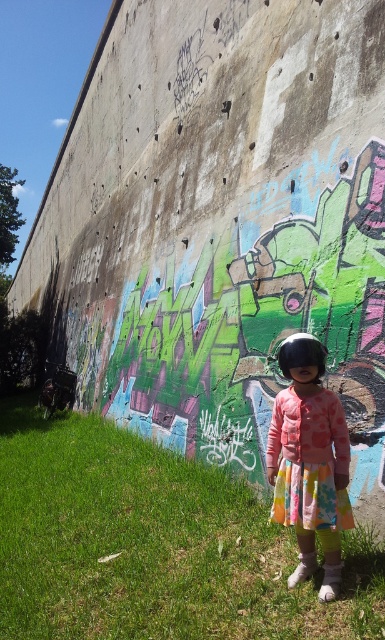
You are a photographer trying to capture the child in the scene. Since the green grass at lower left and the matte pink dress at center are both in the frame, which one appears larger in the image?

The green grass at lower left is bigger than the matte pink dress at center, so the green grass at lower left appears larger in the image.

You are a photographer trying to capture the child in the scene. You notice two points marked in the image at coordinates point (10, 580) and point (299, 566). Which point is closer to the camera?

Point (10, 580) is further to the camera than point (299, 566), so the closer point to the camera is point (299, 566).